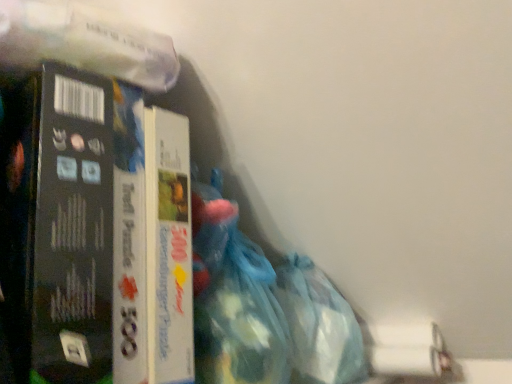
Question: Is translucent plastic bag at lower center inside matte cardboard puzzle box at left?

Choices:
 (A) yes
 (B) no

Answer: (B)

Question: Considering the relative positions of matte cardboard puzzle box at left and translucent plastic bag at lower center in the image provided, is matte cardboard puzzle box at left to the left of translucent plastic bag at lower center from the viewer's perspective?

Choices:
 (A) yes
 (B) no

Answer: (A)

Question: From the image's perspective, is matte cardboard puzzle box at left beneath translucent plastic bag at lower center?

Choices:
 (A) no
 (B) yes

Answer: (A)

Question: Would you say matte cardboard puzzle box at left is a long distance from translucent plastic bag at lower center?

Choices:
 (A) no
 (B) yes

Answer: (A)

Question: Is matte cardboard puzzle box at left placed right next to translucent plastic bag at lower center?

Choices:
 (A) yes
 (B) no

Answer: (B)

Question: Considering the relative sizes of matte cardboard puzzle box at left and translucent plastic bag at lower center in the image provided, is matte cardboard puzzle box at left bigger than translucent plastic bag at lower center?

Choices:
 (A) yes
 (B) no

Answer: (A)

Question: Is translucent plastic bag at lower center taller than matte cardboard puzzle box at left?

Choices:
 (A) yes
 (B) no

Answer: (B)

Question: From the image's perspective, would you say translucent plastic bag at lower center is positioned over matte cardboard puzzle box at left?

Choices:
 (A) no
 (B) yes

Answer: (A)

Question: Are translucent plastic bag at lower center and matte cardboard puzzle box at left located far from each other?

Choices:
 (A) no
 (B) yes

Answer: (A)

Question: From the image's perspective, is translucent plastic bag at lower center under matte cardboard puzzle box at left?

Choices:
 (A) yes
 (B) no

Answer: (A)

Question: Is translucent plastic bag at lower center oriented towards matte cardboard puzzle box at left?

Choices:
 (A) yes
 (B) no

Answer: (B)

Question: Is translucent plastic bag at lower center wider than matte cardboard puzzle box at left?

Choices:
 (A) no
 (B) yes

Answer: (A)

Question: Is translucent blue plastic bag at lower right turned away from matte cardboard puzzle box at left?

Choices:
 (A) no
 (B) yes

Answer: (A)